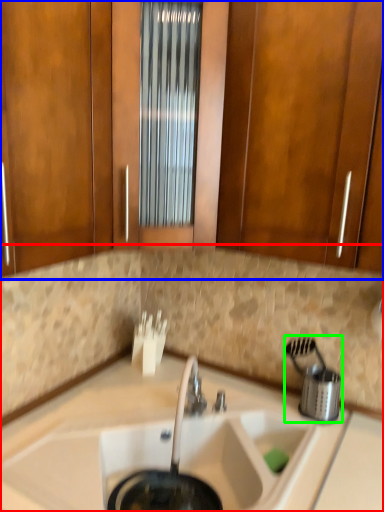
Question: Which is nearer to the countertop (highlighted by a red box)? cabinetry (highlighted by a blue box) or appliance (highlighted by a green box).

Choices:
 (A) cabinetry
 (B) appliance

Answer: (B)